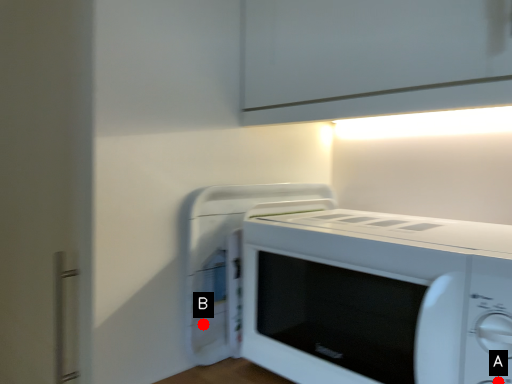
Question: Two points are circled on the image, labeled by A and B beside each circle. Which of the following is the farthest from the observer?

Choices:
 (A) A is further
 (B) B is further

Answer: (B)